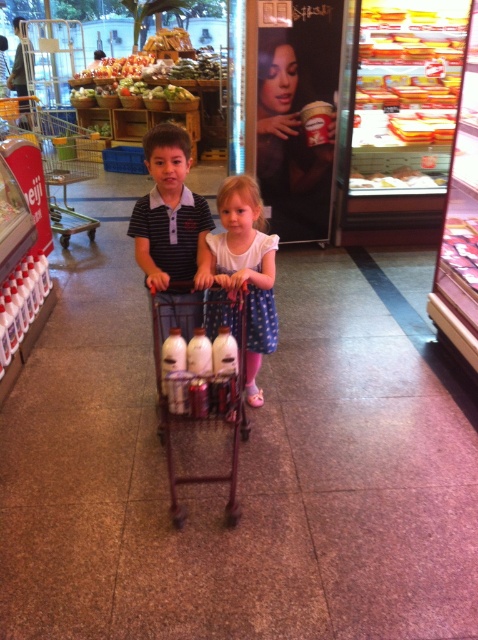
Question: Estimate the real-world distances between objects in this image. Which object is farther from the metallic silver trolley at center?

Choices:
 (A) metallic brown trolley at center
 (B) white polka dot dress at center

Answer: (A)

Question: Does white polka dot dress at center appear over metallic silver trolley at center?

Choices:
 (A) no
 (B) yes

Answer: (A)

Question: Can you confirm if metallic brown trolley at center is bigger than metallic silver trolley at center?

Choices:
 (A) no
 (B) yes

Answer: (A)

Question: From the image, what is the correct spatial relationship of white polka dot dress at center in relation to metallic silver trolley at center?

Choices:
 (A) above
 (B) below

Answer: (B)

Question: Which point is closer to the camera taking this photo?

Choices:
 (A) (53, 163)
 (B) (230, 193)
 (C) (238, 305)

Answer: (B)

Question: Which point is farther from the camera taking this photo?

Choices:
 (A) (97, 134)
 (B) (160, 380)

Answer: (A)